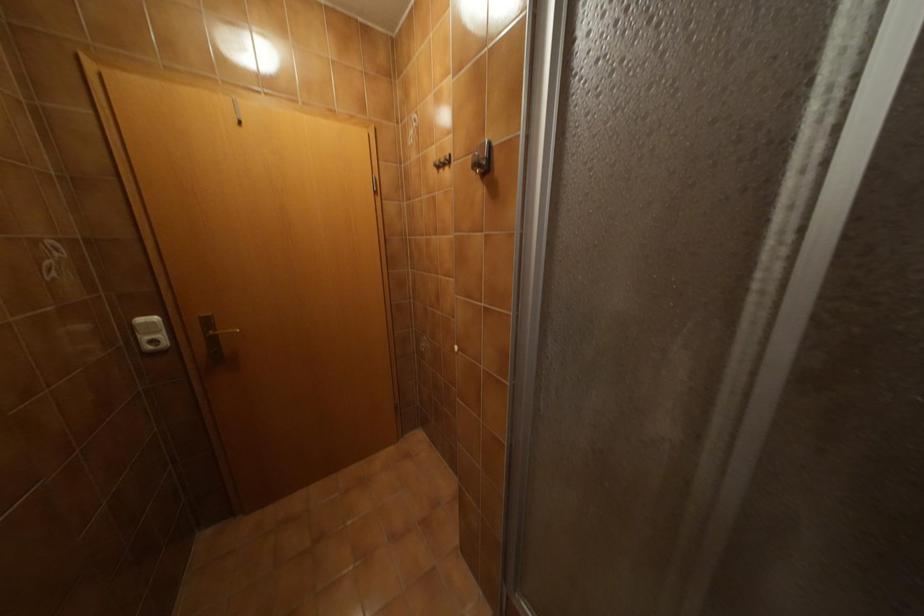
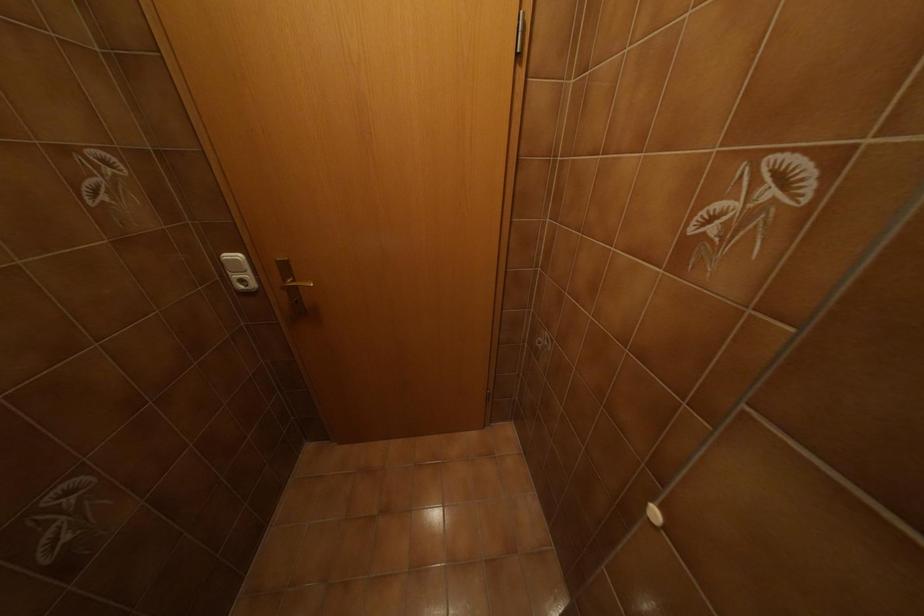
Based on the continuous images, in which direction is the camera rotating?

The camera's rotation is toward left-down.